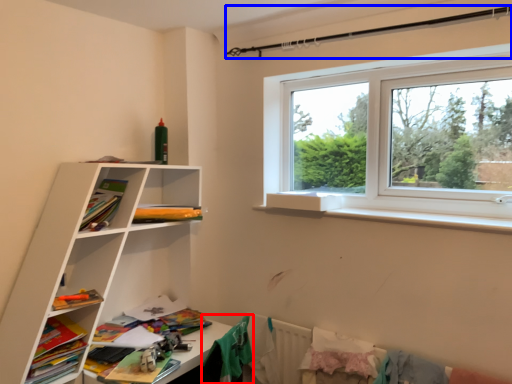
Question: Among these objects, which one is nearest to the camera, clothing (highlighted by a red box) or clothesline (highlighted by a blue box)?

Choices:
 (A) clothing
 (B) clothesline

Answer: (B)